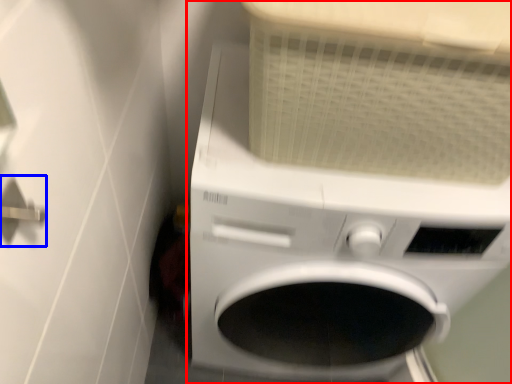
Question: Which object appears closest to the camera in this image, washing machine (highlighted by a red box) or door handle (highlighted by a blue box)?

Choices:
 (A) washing machine
 (B) door handle

Answer: (B)